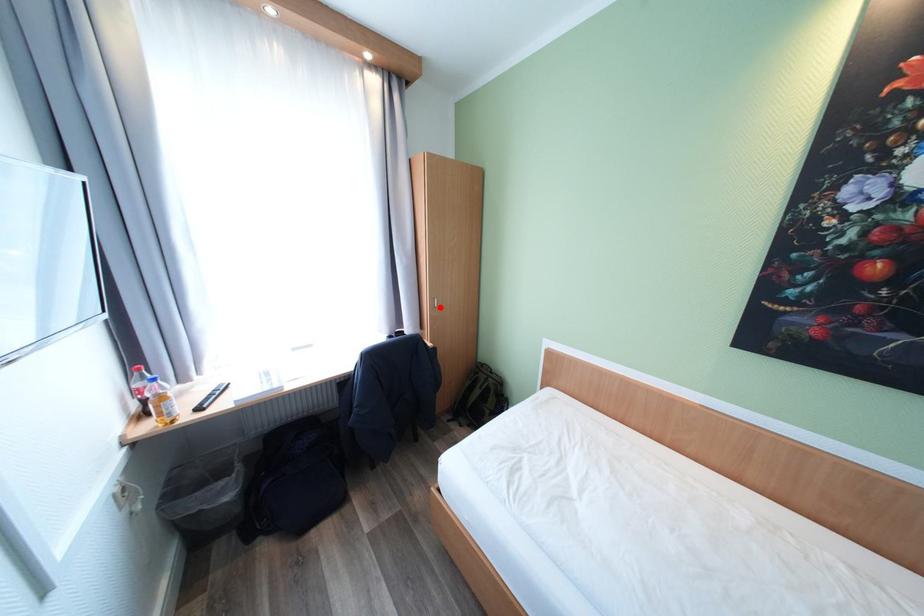
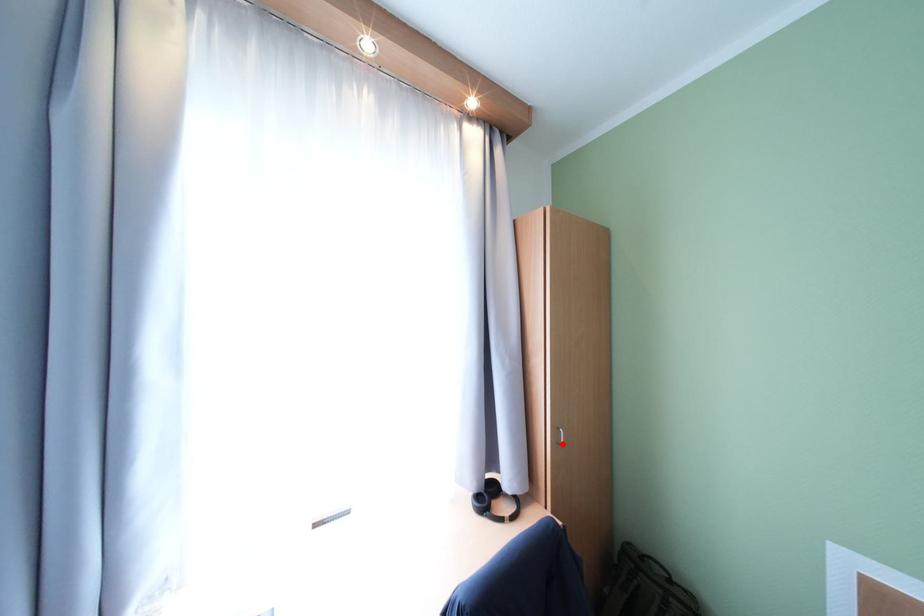
I am providing you with two images of the same scene from different viewpoints. A red point is marked on the first image and another point is marked on the second image. Do the highlighted points in image1 and image2 indicate the same real-world spot?

Yes